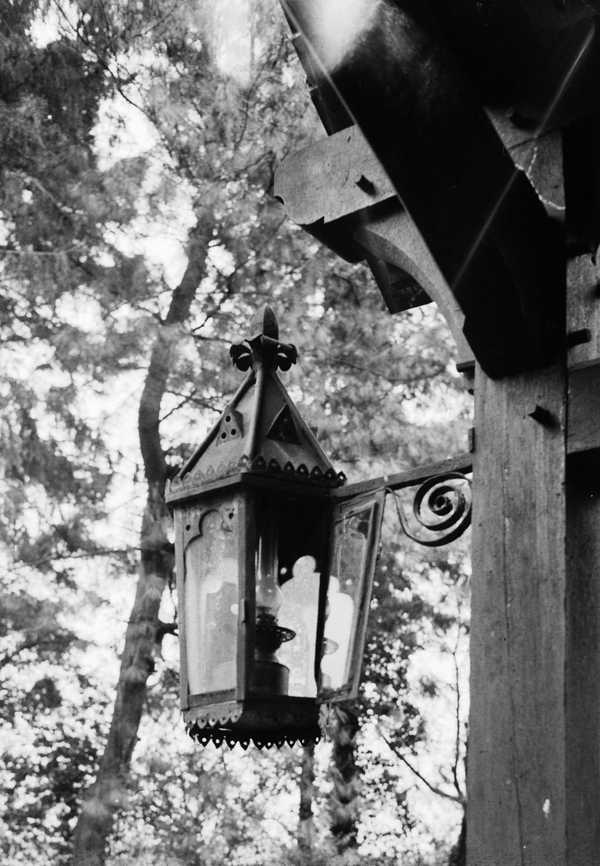
Find the location of a particular element. lantern is located at coordinates (258, 441).